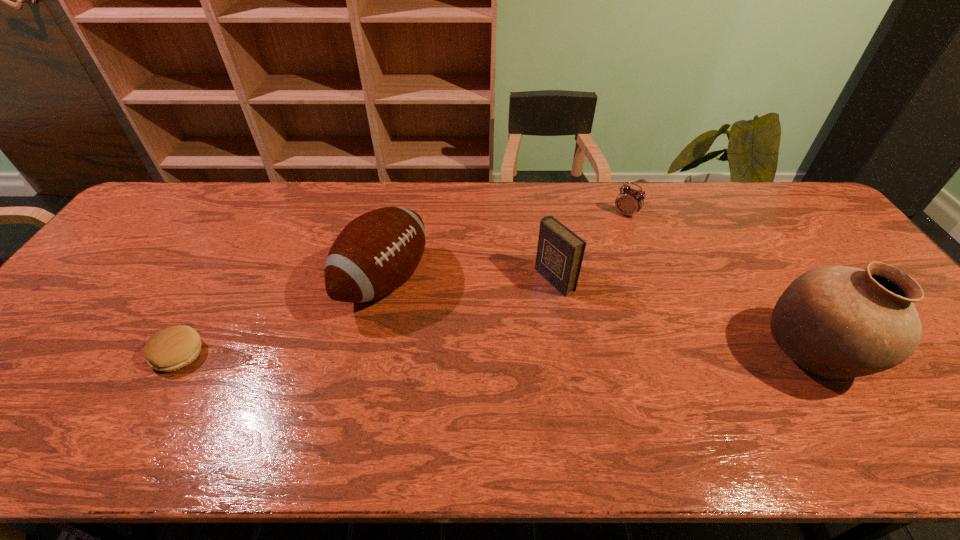
The width and height of the screenshot is (960, 540). In order to click on vacant spot on the desktop that is between the leftmost object and the rightmost object and is positioned on the laces of the second tallest object in this screenshot , I will do `click(540, 354)`.

This screenshot has width=960, height=540. I want to click on free space on the desktop that is between the leftmost object and the pottery and is positioned on the front cover of the diary, so click(x=419, y=354).

This screenshot has height=540, width=960. I want to click on vacant spot on the desktop that is between the shortest object and the pottery and is positioned on the face of the alarm clock, so click(x=517, y=354).